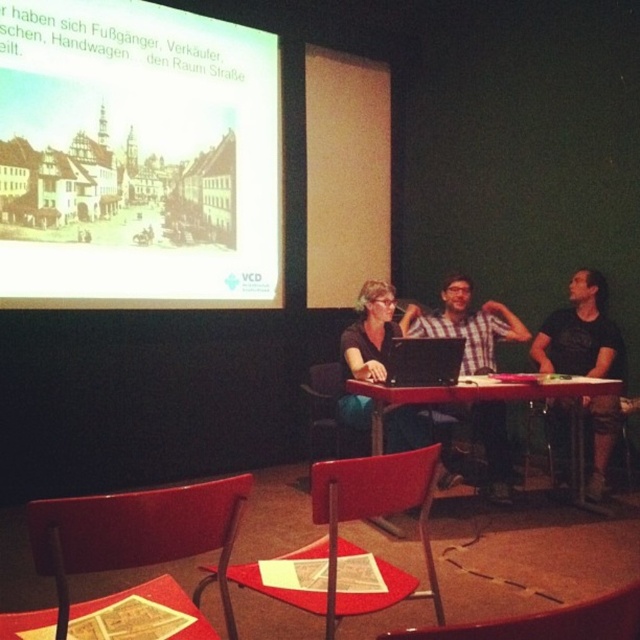
You are an attendee at a lecture hall presentation. You need to place your black matte laptop at center on top of the metallic red chair at lower center. Is this possible based on their positions?

The metallic red chair at lower center is below the black matte laptop at center, so placing the black matte laptop at center on top of the metallic red chair at lower center would not be possible as the chair is positioned lower than the laptop.

In the presentation setting, there are red chairs arranged in rows facing the stage area. The metallic red chair at lower center is represented by point (548, 621). Where is the metallic red chair at lower center located in the image?

The metallic red chair at lower center is located at point (548, 621) in the image.